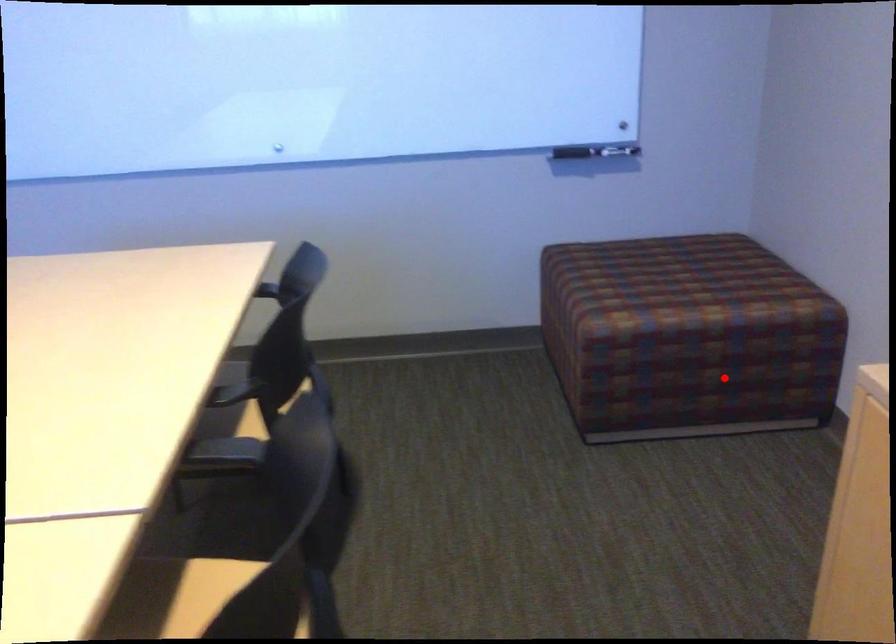
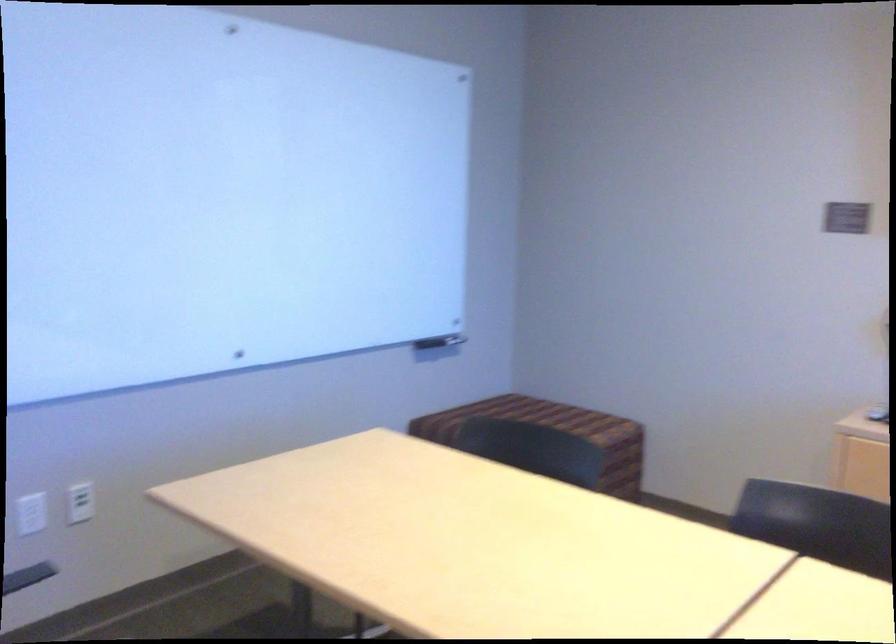
Question: I am providing you with two images of the same scene from different viewpoints. A red point is shown in image1. For the corresponding object point in image2, is it positioned nearer or farther from the camera?

Choices:
 (A) Nearer
 (B) Farther

Answer: (B)